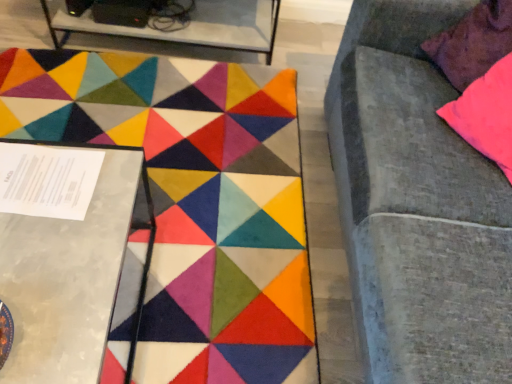
Question: Is pink fabric pillow at upper right wider or thinner than metallic silver table at left, placed as the first table when sorted from front to back?

Choices:
 (A) thin
 (B) wide

Answer: (A)

Question: From their relative heights in the image, would you say pink fabric pillow at upper right is taller or shorter than metallic silver table at left, placed as the first table when sorted from front to back?

Choices:
 (A) tall
 (B) short

Answer: (B)

Question: Estimate the real-world distances between objects in this image. Which object is closer to the metallic silver table at left, positioned as the second table in top-to-bottom order?

Choices:
 (A) carpet with geometric patterns at center
 (B) velvet gray couch at right
 (C) metallic glass table at upper left, marked as the 1th table in a back-to-front arrangement
 (D) pink fabric pillow at upper right

Answer: (A)

Question: Which object is the farthest from the pink fabric pillow at upper right?

Choices:
 (A) velvet gray couch at right
 (B) metallic silver table at left, positioned as the 1th table in bottom-to-top order
 (C) metallic glass table at upper left, arranged as the 2th table when viewed from the front
 (D) carpet with geometric patterns at center

Answer: (B)